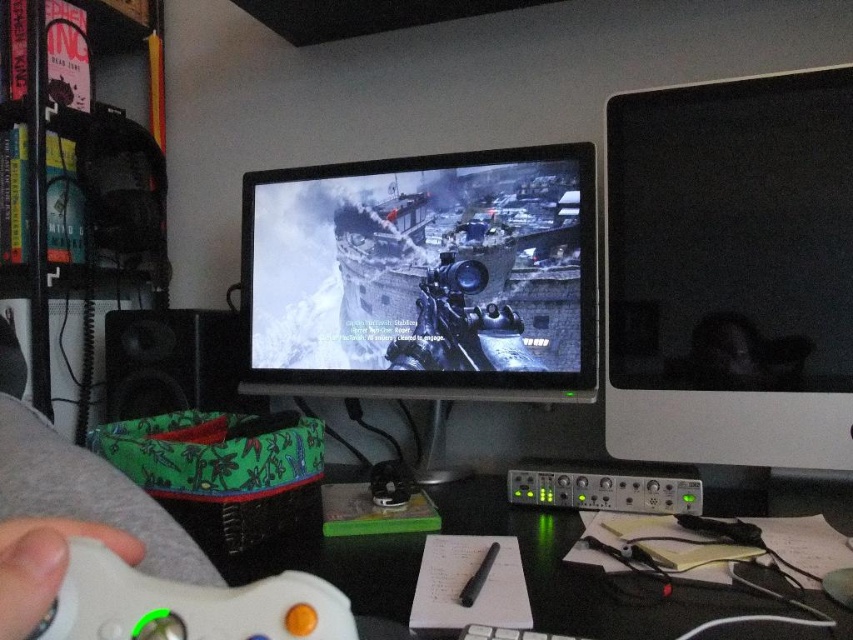
You are setting up a new monitor that is 5 cm thick. You have space next to the black plastic computer desk at center. Can the black glossy monitor at right fit there without exceeding the space?

The black glossy monitor at right is thinner than the black plastic computer desk at center, so it can fit in the space next to the black plastic computer desk at center since it is narrower.

You are setting up a new monitor and need to place it closer to you than the existing black plastic computer desk at center. Can you place the new monitor in front of the black glossy monitor at right?

The black glossy monitor at right is already further to the viewer than the black plastic computer desk at center, so placing the new monitor in front of the black glossy monitor at right would position it even closer, meeting your requirement.

You are setting up a gaming setup and need to place a new wireless charger between the black glossy monitor at right and the white matte game controller at lower left. Based on their positions, where should you place the wireless charger?

Since the black glossy monitor at right is to the right of the white matte game controller at lower left, you should place the wireless charger between them, positioning it to the right of the white matte game controller at lower left and to the left of the black glossy monitor at right.